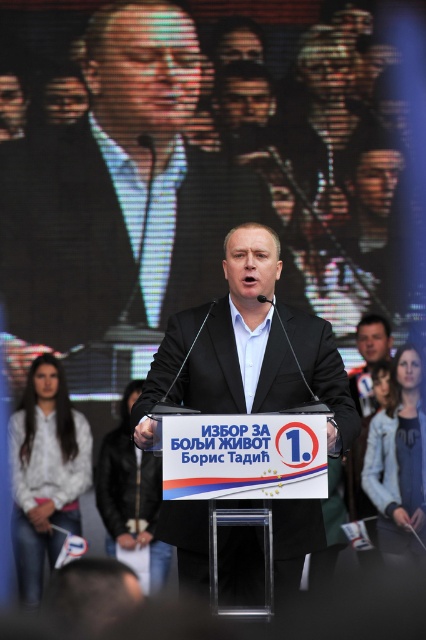
You are a photographer at the event and want to capture a closeup of the podium sign and the large screen behind the speaker. Based on their positions, will the podium sign at point (5, 244) be closer to your camera than the large screen at point (302, 515)?

Yes, the podium sign at point (5, 244) is closer to the camera than the large screen at point (302, 515) because it is further to the viewer according to the description.

You are a photographer at the event and need to capture a clear photo of both the black matte suit at center and the matte black suit at center. Which one should you focus on first to ensure it appears larger in the photo?

The black matte suit at center has a greater height compared to the matte black suit at center, so you should focus on the black matte suit at center first to ensure it appears larger in the photo.